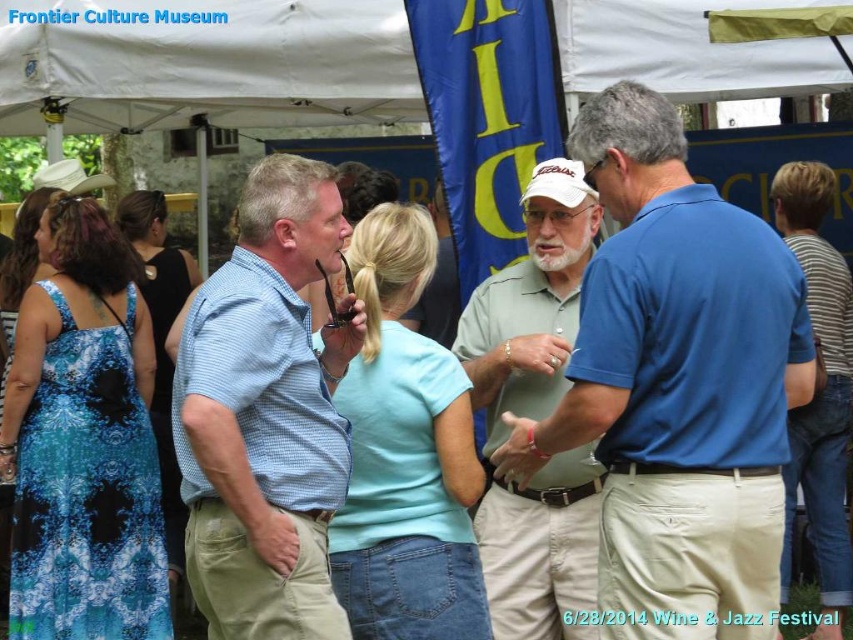
Who is more distant from viewer, (699, 584) or (314, 196)?

Positioned behind is point (314, 196).

Is point (722, 486) positioned behind point (294, 451)?

No, it is not.

At what (x,y) coordinates should I click in order to perform the action: click on matte blue shirt at center. Please return your answer as a coordinate pair (x, y). Looking at the image, I should click on (677, 385).

Does light green polo shirt at center appear under blue denim jeans at right?

Actually, light green polo shirt at center is above blue denim jeans at right.

Is light green polo shirt at center smaller than blue denim jeans at right?

Indeed, light green polo shirt at center has a smaller size compared to blue denim jeans at right.

Find the location of a particular element. light green polo shirt at center is located at coordinates (531, 304).

Where is `light green polo shirt at center`? light green polo shirt at center is located at coordinates pos(531,304).

Between blue checkered shirt at center and blue denim jeans at right, which one appears on the right side from the viewer's perspective?

blue denim jeans at right

Who is higher up, blue checkered shirt at center or blue denim jeans at right?

blue checkered shirt at center is higher up.

Who is more distant from viewer, [256,492] or [824,324]?

Point [824,324]

At what (x,y) coordinates should I click in order to perform the action: click on blue checkered shirt at center. Please return your answer as a coordinate pair (x, y). Image resolution: width=853 pixels, height=640 pixels. Looking at the image, I should click on click(265, 413).